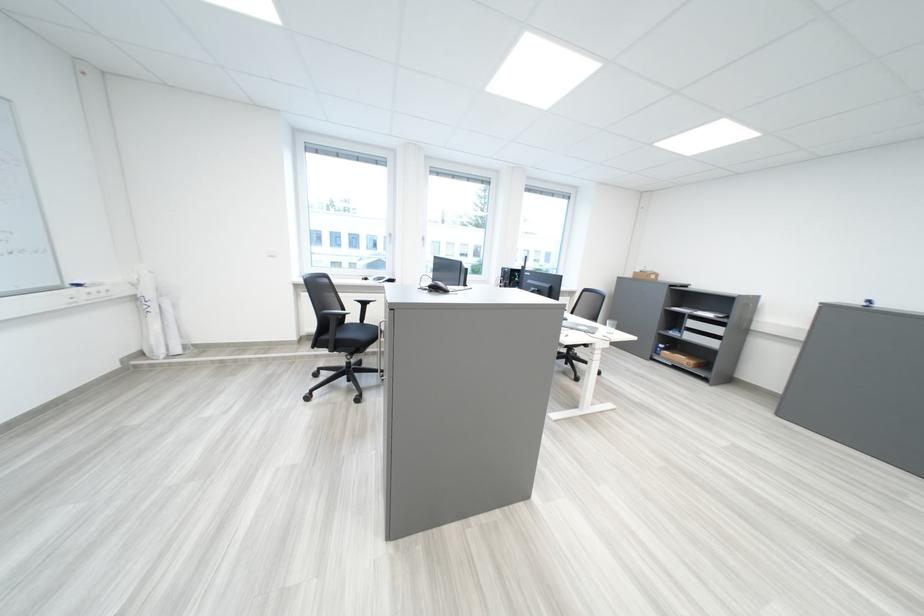
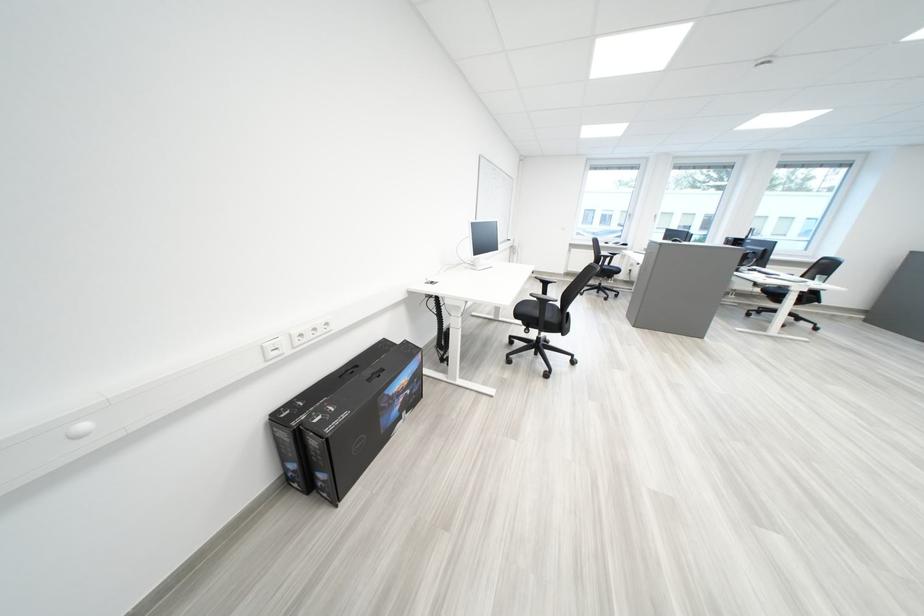
Question: I am providing you with two images of the same scene from different viewpoints. After the viewpoint changes to image2, which objects are now occluded?

Choices:
 (A) chair sitting surface
 (B) grey computer mouse
 (C) grey and black backpack
 (D) box plastic handle

Answer: (B)